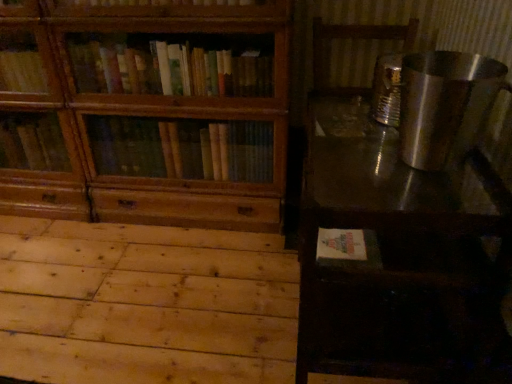
Question: In the image, is metallic reflective table at right on the left side or the right side of wooden bookcase at left?

Choices:
 (A) right
 (B) left

Answer: (A)

Question: Is metallic reflective table at right situated inside wooden bookcase at left or outside?

Choices:
 (A) inside
 (B) outside

Answer: (B)

Question: Estimate the real-world distances between objects in this image. Which object is closer to the wooden bookcase at left?

Choices:
 (A) natural wood plywood at lower left
 (B) metallic reflective table at right

Answer: (A)

Question: Which object is the closest to the metallic reflective table at right?

Choices:
 (A) natural wood plywood at lower left
 (B) wooden bookcase at left

Answer: (A)